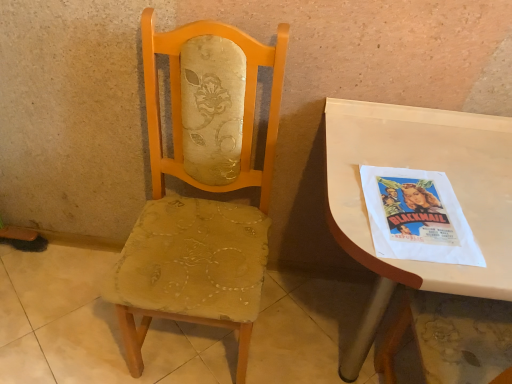
In order to click on free area below matte yellow fabric chair at center (from a real-world perspective) in this screenshot , I will do tap(192, 351).